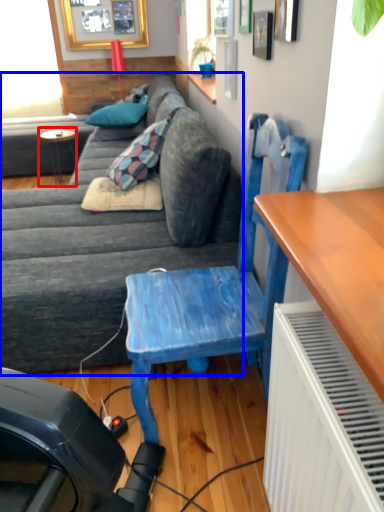
Question: Among these objects, which one is farthest to the camera, table (highlighted by a red box) or studio couch (highlighted by a blue box)?

Choices:
 (A) table
 (B) studio couch

Answer: (A)